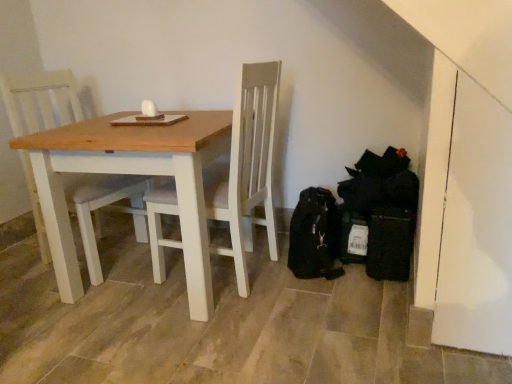
Question: Which is correct: wooden table at center is inside white wood chair at center, or outside of it?

Choices:
 (A) inside
 (B) outside

Answer: (B)

Question: Considering the positions of wooden table at center and white wood chair at center in the image, is wooden table at center wider or thinner than white wood chair at center?

Choices:
 (A) wide
 (B) thin

Answer: (A)

Question: Based on their sizes in the image, would you say wooden table at center is bigger or smaller than white wood chair at center?

Choices:
 (A) big
 (B) small

Answer: (A)

Question: Visually, is white wood chair at center positioned to the left or to the right of wooden table at center?

Choices:
 (A) left
 (B) right

Answer: (A)

Question: From their relative heights in the image, would you say white wood chair at center is taller or shorter than wooden table at center?

Choices:
 (A) tall
 (B) short

Answer: (A)

Question: In terms of size, does white wood chair at center appear bigger or smaller than wooden table at center?

Choices:
 (A) small
 (B) big

Answer: (A)

Question: Would you say white wood chair at center is inside or outside wooden table at center?

Choices:
 (A) outside
 (B) inside

Answer: (B)